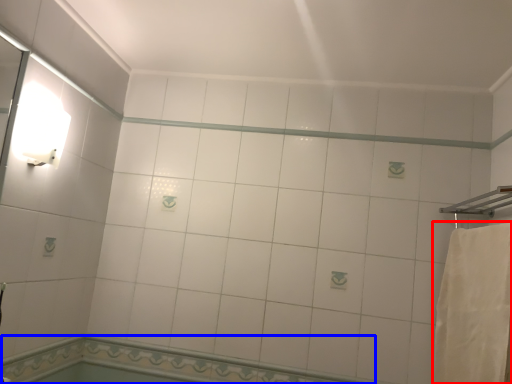
Question: Which point is closer to the camera, bath towel (highlighted by a red box) or bath (highlighted by a blue box)?

Choices:
 (A) bath towel
 (B) bath

Answer: (A)